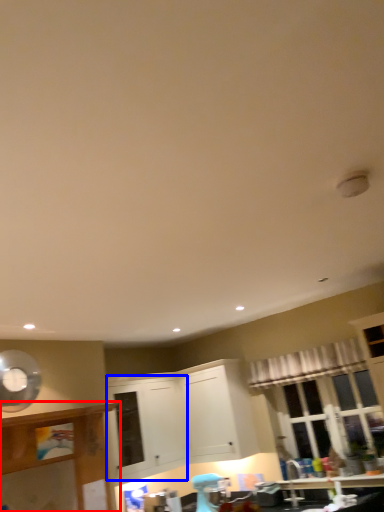
Question: Which object appears closest to the camera in this image, cabinetry (highlighted by a red box) or cabinetry (highlighted by a blue box)?

Choices:
 (A) cabinetry
 (B) cabinetry

Answer: (A)